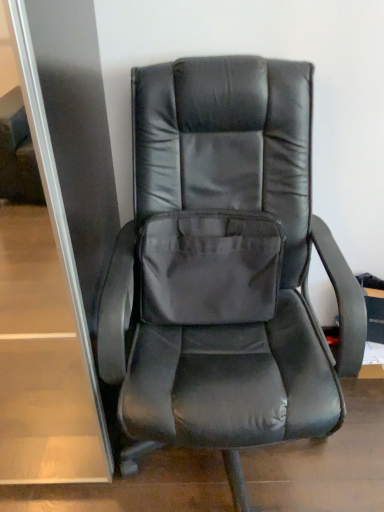
Question: Is gray fabric pocket at center surrounded by matte black chair at center?

Choices:
 (A) no
 (B) yes

Answer: (B)

Question: Does matte black chair at center turn towards gray fabric pocket at center?

Choices:
 (A) yes
 (B) no

Answer: (A)

Question: Does matte black chair at center have a larger size compared to gray fabric pocket at center?

Choices:
 (A) yes
 (B) no

Answer: (A)

Question: Does matte black chair at center have a smaller size compared to gray fabric pocket at center?

Choices:
 (A) no
 (B) yes

Answer: (A)

Question: Is gray fabric pocket at center at the back of matte black chair at center?

Choices:
 (A) no
 (B) yes

Answer: (B)

Question: From a real-world perspective, is matte black chair at center below gray fabric pocket at center?

Choices:
 (A) no
 (B) yes

Answer: (B)

Question: Is the position of gray fabric pocket at center more distant than that of matte black chair at center?

Choices:
 (A) no
 (B) yes

Answer: (B)

Question: Can you confirm if gray fabric pocket at center is smaller than matte black chair at center?

Choices:
 (A) no
 (B) yes

Answer: (B)

Question: Is gray fabric pocket at center thinner than matte black chair at center?

Choices:
 (A) no
 (B) yes

Answer: (B)

Question: Can you confirm if gray fabric pocket at center is shorter than matte black chair at center?

Choices:
 (A) yes
 (B) no

Answer: (A)

Question: Is gray fabric pocket at center at the right side of matte black chair at center?

Choices:
 (A) yes
 (B) no

Answer: (B)

Question: Is gray fabric pocket at center wider than matte black chair at center?

Choices:
 (A) yes
 (B) no

Answer: (B)

Question: From the image's perspective, is matte black chair at center positioned above or below gray fabric pocket at center?

Choices:
 (A) below
 (B) above

Answer: (A)